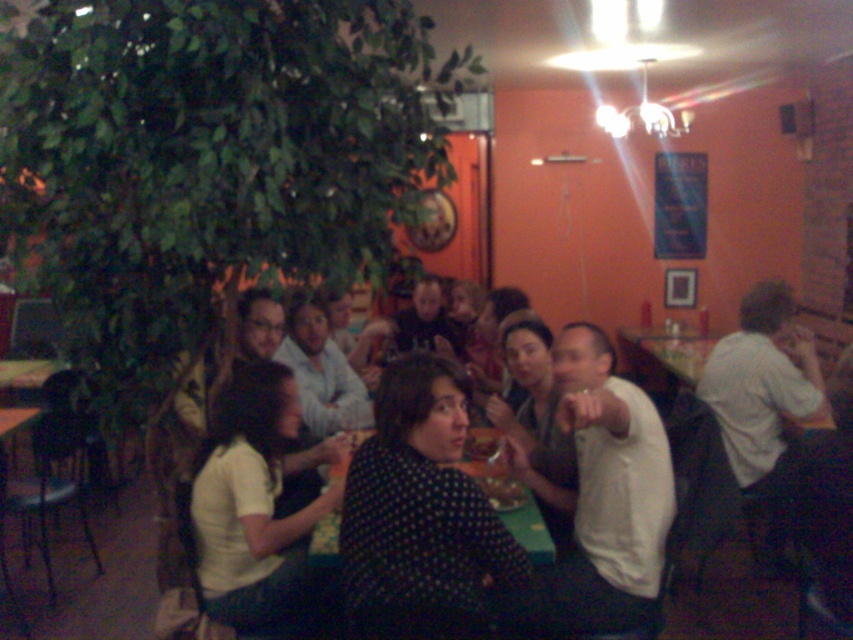
You are a photographer standing in the middle of the restaurant. You want to take a photo that includes both the point at coordinate (618, 600) and the point at coordinate (250, 520). Which point is closer to your camera lens?

Point at coordinate (618, 600) is closer to the camera lens than point at coordinate (250, 520).